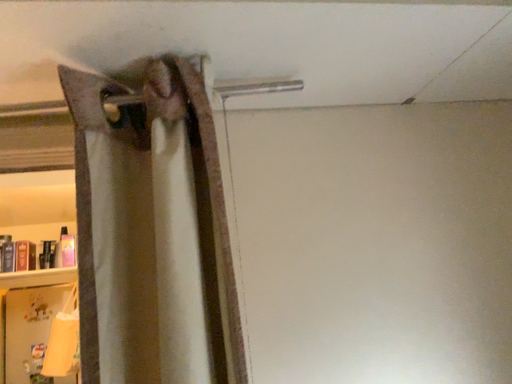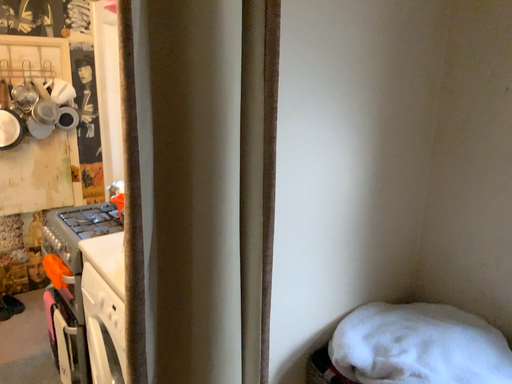
Question: Which way did the camera rotate in the video?

Choices:
 (A) rotated right
 (B) rotated left

Answer: (A)